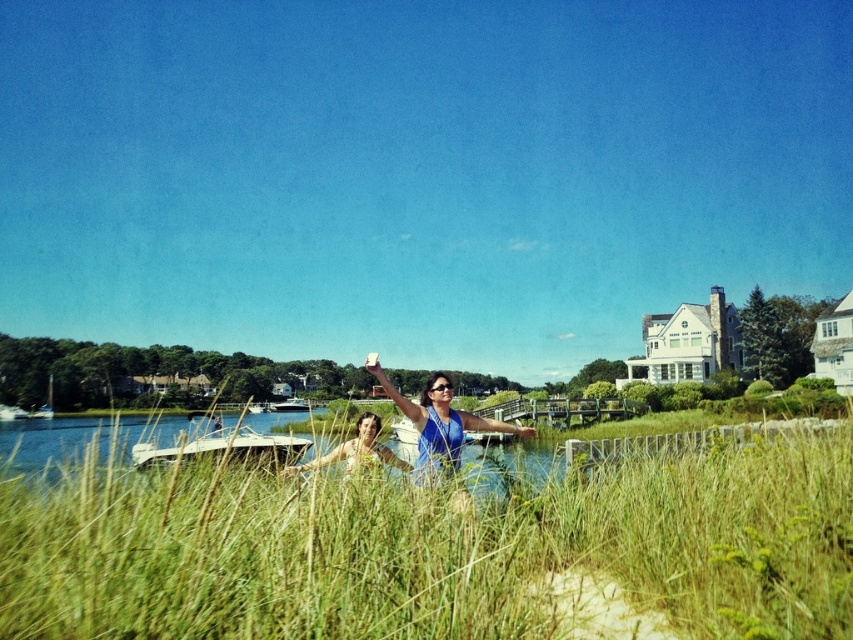
Question: Is white glossy boat at lower left thinner than matte blue shirt at center?

Choices:
 (A) yes
 (B) no

Answer: (B)

Question: Which object is closer to the camera taking this photo?

Choices:
 (A) white glossy boat at center
 (B) blue fabric at center

Answer: (B)

Question: From the image, what is the correct spatial relationship of white glossy boat at lower left in relation to white glossy boat at center?

Choices:
 (A) right
 (B) left

Answer: (A)

Question: Is blue fabric at center above matte blue shirt at center?

Choices:
 (A) no
 (B) yes

Answer: (A)

Question: Among these objects, which one is nearest to the camera?

Choices:
 (A) white glossy boat at lower left
 (B) green grassy at center
 (C) blue fabric at center
 (D) white glossy boat at center

Answer: (B)

Question: Which object is the closest to the blue fabric at center?

Choices:
 (A) green grassy at center
 (B) white glossy boat at lower left

Answer: (A)